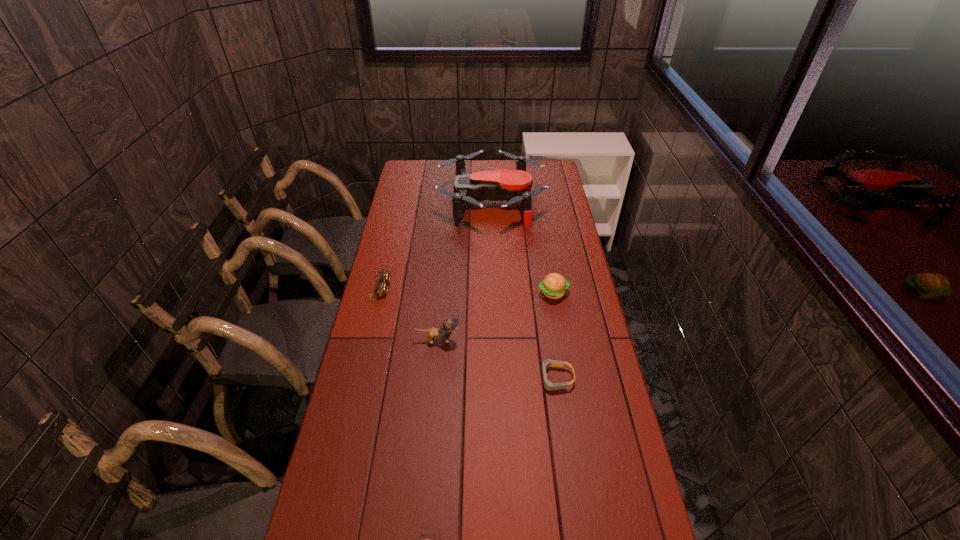
Where is `vacant space located 0.060m on the camera side of the farthest object`? This screenshot has width=960, height=540. vacant space located 0.060m on the camera side of the farthest object is located at coordinates pyautogui.click(x=423, y=203).

You are a GUI agent. You are given a task and a screenshot of the screen. Output one action in this format:
    pyautogui.click(x=<x>, y=<y>)
    Task: Click on the free space located on the camera side of the farthest object
    The width and height of the screenshot is (960, 540).
    Given the screenshot: What is the action you would take?
    pyautogui.click(x=402, y=203)

At what (x,y) coordinates should I click in order to perform the action: click on blank space located on the front-facing side of the third nearest object. Please return your answer as a coordinate pair (x, y). Looking at the image, I should click on (492, 340).

At what (x,y) coordinates should I click in order to perform the action: click on vacant region located 0.280m on the left of the hamburger. Please return your answer as a coordinate pair (x, y). This screenshot has height=540, width=960. Looking at the image, I should click on 463,293.

Locate an element on the screen. The image size is (960, 540). free space located 0.080m through the lenses of the leftmost goggles is located at coordinates (411, 288).

Find the location of a particular element. vacant position located 0.070m on the front and back of the rightmost goggles is located at coordinates (515, 378).

You are a GUI agent. You are given a task and a screenshot of the screen. Output one action in this format:
    pyautogui.click(x=<x>, y=<y>)
    Task: Click on the vacant area located on the front and back of the rightmost goggles
    
    Given the screenshot: What is the action you would take?
    pyautogui.click(x=475, y=378)

Locate an element on the screen. Image resolution: width=960 pixels, height=540 pixels. vacant space located on the front and back of the rightmost goggles is located at coordinates (511, 378).

Where is `object at the far edge`? object at the far edge is located at coordinates (513, 186).

The height and width of the screenshot is (540, 960). I want to click on object that is positioned at the left edge, so click(x=381, y=287).